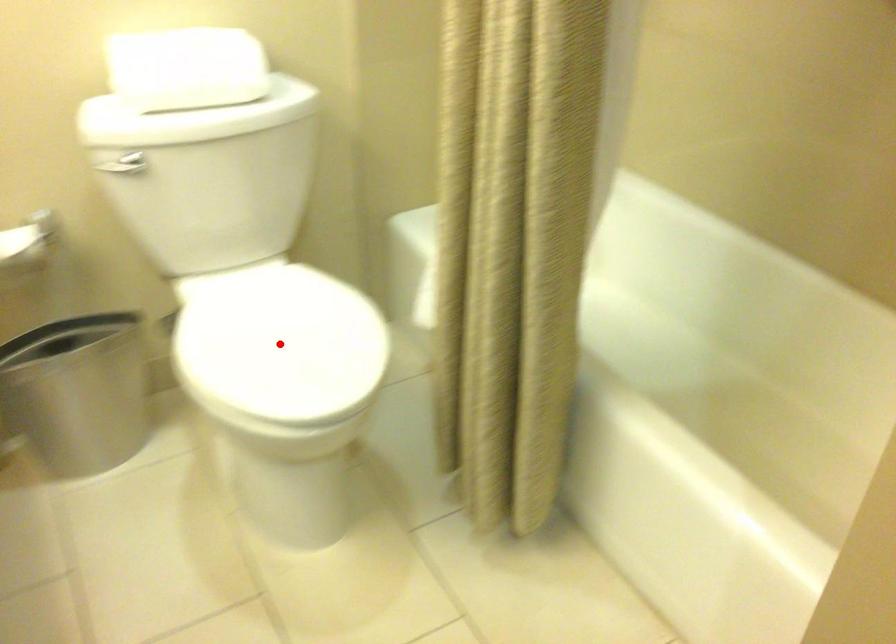
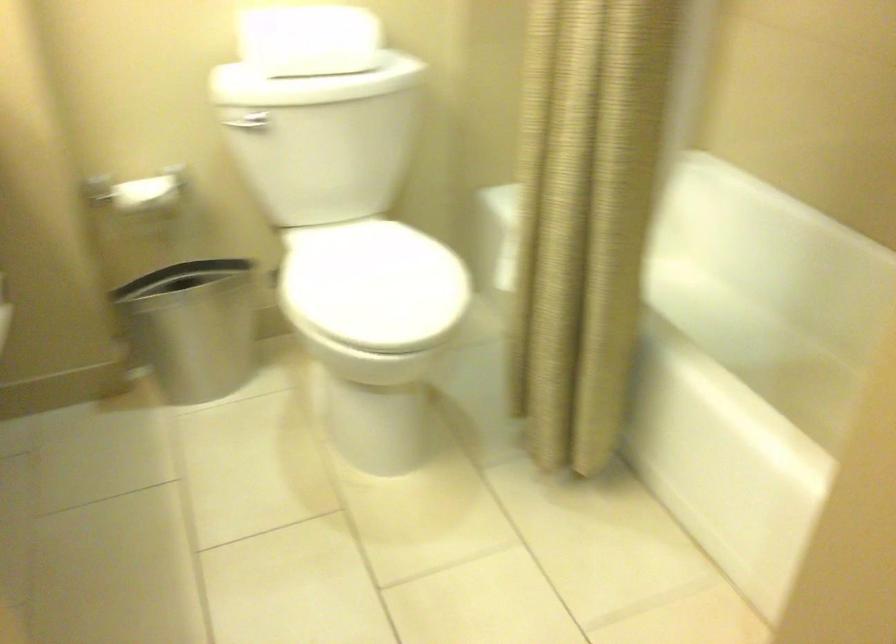
Question: I am providing you with two images of the same scene from different viewpoints. Given a red point in image1, look at the same physical point in image2. Is it:

Choices:
 (A) Closer to the viewpoint
 (B) Farther from the viewpoint

Answer: (B)